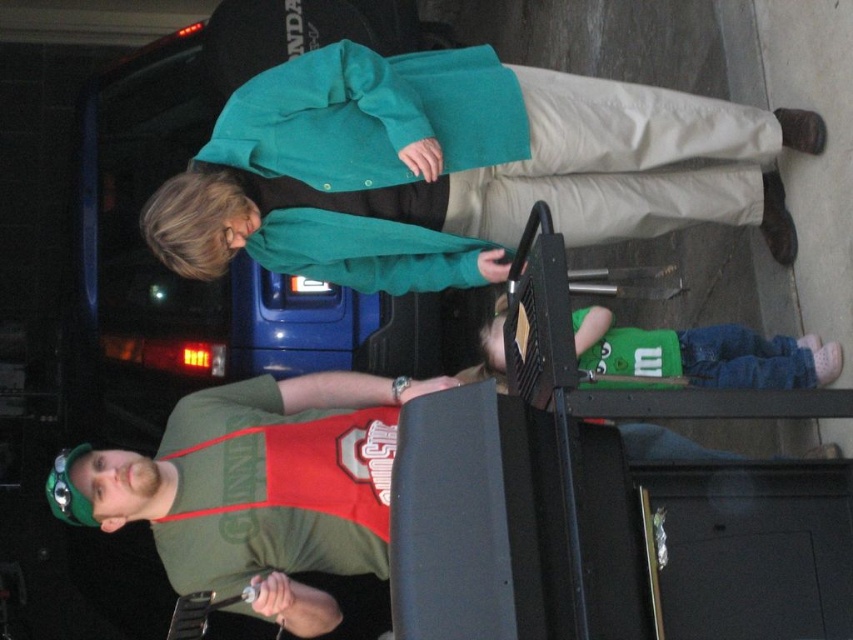
What do you see at coordinates (450, 166) in the screenshot?
I see `teal fabric coat at upper center` at bounding box center [450, 166].

In the scene shown: Is teal fabric coat at upper center to the right of green matte shirt at lower right from the viewer's perspective?

Incorrect, teal fabric coat at upper center is not on the right side of green matte shirt at lower right.

Is point (526, 120) farther from camera compared to point (659, 360)?

No, (526, 120) is in front of (659, 360).

The height and width of the screenshot is (640, 853). In order to click on teal fabric coat at upper center in this screenshot , I will do `click(450, 166)`.

Between green matte t-shirt at center and green matte shirt at lower right, which one appears on the left side from the viewer's perspective?

Positioned to the left is green matte t-shirt at center.

Can you confirm if green matte t-shirt at center is positioned below green matte shirt at lower right?

Correct, green matte t-shirt at center is located below green matte shirt at lower right.

The image size is (853, 640). What are the coordinates of `green matte t-shirt at center` in the screenshot? It's located at (257, 488).

Between black plastic lift at lower center and green matte t-shirt at center, which one is positioned higher?

black plastic lift at lower center

Can you confirm if black plastic lift at lower center is taller than green matte t-shirt at center?

No.

Which is in front, point (552, 493) or point (316, 563)?

Positioned in front is point (552, 493).

Find the location of a particular element. black plastic lift at lower center is located at coordinates (479, 520).